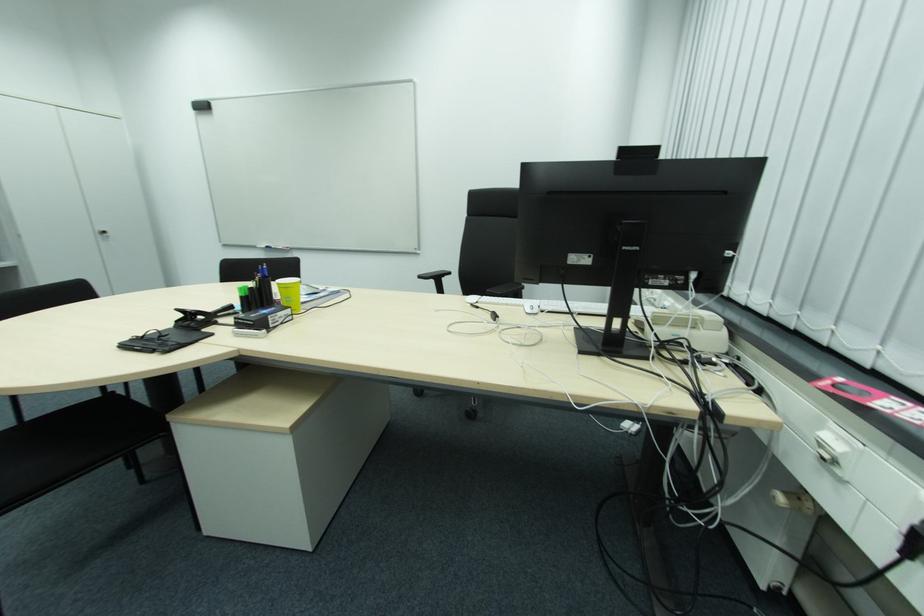
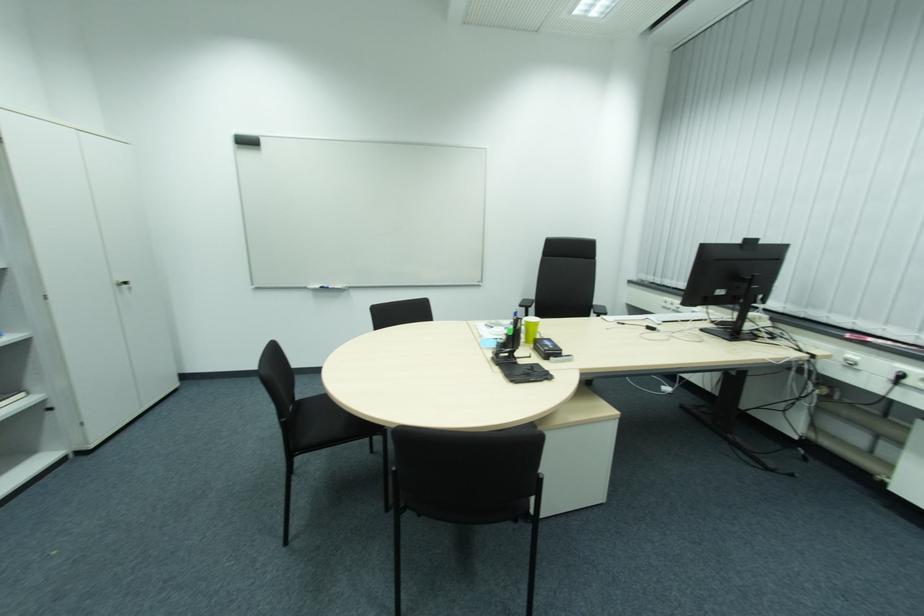
In the second image, find the point that corresponds to (x=207, y=108) in the first image.

(252, 144)